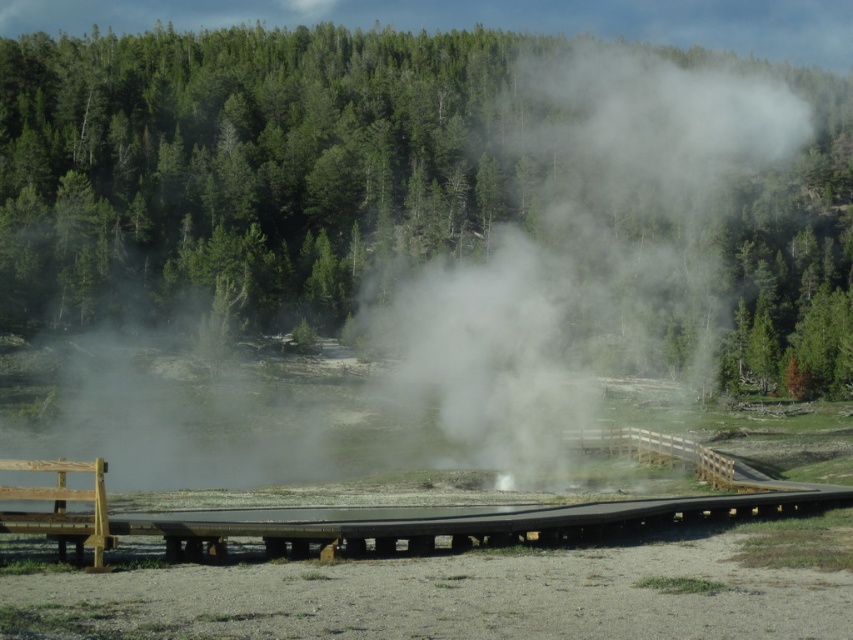
You are standing at the camera position and want to reach the point marked at coordinates (x=549, y=316). Given that the walkway is 140 meters long, can you walk directly to that point along the walkway?

The point marked at coordinates (x=549, y=316) is 142.51 meters away from the camera, which is slightly longer than the walkway length of 140 meters. Therefore, you cannot reach it directly via the walkway.

Looking at this image, you are standing on the curved wooden walkway in the geothermal area. You notice two points marked on the ground ahead of you. The first point is at coordinate point (363, 522), and the second point is at coordinate point (94, 522). Which point is closer to your current position on the walkway?

Point (94, 522) is closer to your current position on the walkway because it is nearer to the camera compared to point (363, 522), which is further away.